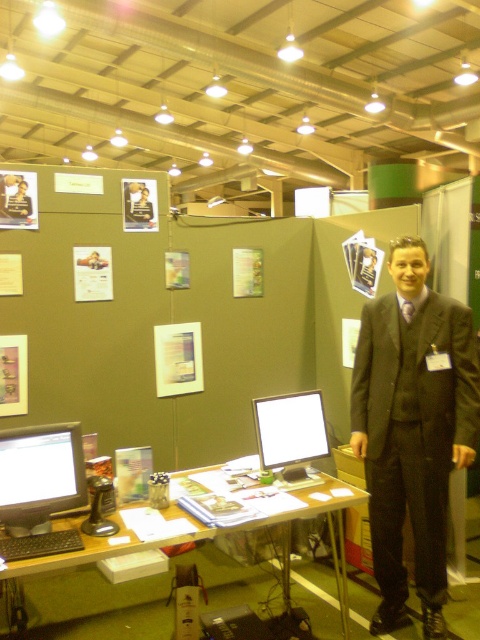
Question: Which object is farther from the camera taking this photo?

Choices:
 (A) wooden desk at center
 (B) matte black monitor at left

Answer: (B)

Question: Can you confirm if matte black monitor at left is positioned to the left of matte white monitor at center?

Choices:
 (A) no
 (B) yes

Answer: (B)

Question: Is matte black monitor at left to the left of wooden desk at center from the viewer's perspective?

Choices:
 (A) yes
 (B) no

Answer: (A)

Question: Does matte white monitor at center have a larger size compared to wooden desk at center?

Choices:
 (A) yes
 (B) no

Answer: (A)

Question: Which object is positioned closest to the dark gray suit at center?

Choices:
 (A) matte white monitor at center
 (B) matte black monitor at left
 (C) wooden desk at center

Answer: (A)

Question: Which object is farther from the camera taking this photo?

Choices:
 (A) matte white monitor at center
 (B) matte black monitor at left
 (C) dark gray suit at center

Answer: (A)